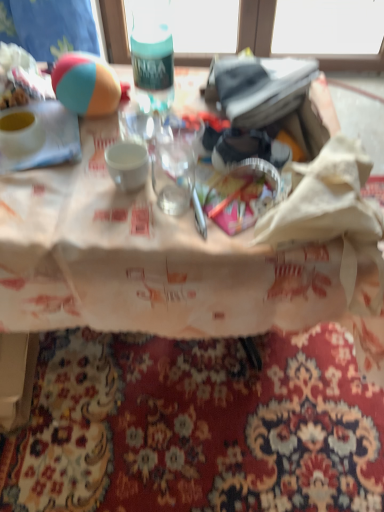
Question: Is matte white bowl at upper left beside teal matte bottle at upper center?

Choices:
 (A) yes
 (B) no

Answer: (B)

Question: Is matte white bowl at upper left oriented towards teal matte bottle at upper center?

Choices:
 (A) no
 (B) yes

Answer: (A)

Question: Can you confirm if matte white bowl at upper left is taller than teal matte bottle at upper center?

Choices:
 (A) yes
 (B) no

Answer: (B)

Question: Is matte white bowl at upper left looking in the opposite direction of teal matte bottle at upper center?

Choices:
 (A) yes
 (B) no

Answer: (B)

Question: Is matte white bowl at upper left at the left side of teal matte bottle at upper center?

Choices:
 (A) no
 (B) yes

Answer: (B)

Question: Does matte white bowl at upper left appear on the right side of teal matte bottle at upper center?

Choices:
 (A) no
 (B) yes

Answer: (A)

Question: From the image's perspective, is teal matte bottle at upper center located beneath tri-color rubber ball at upper left?

Choices:
 (A) no
 (B) yes

Answer: (A)

Question: Is teal matte bottle at upper center at the right side of tri-color rubber ball at upper left?

Choices:
 (A) no
 (B) yes

Answer: (B)

Question: Is teal matte bottle at upper center not close to tri-color rubber ball at upper left?

Choices:
 (A) no
 (B) yes

Answer: (A)

Question: From a real-world perspective, is teal matte bottle at upper center over tri-color rubber ball at upper left?

Choices:
 (A) yes
 (B) no

Answer: (A)

Question: Can you confirm if teal matte bottle at upper center is thinner than tri-color rubber ball at upper left?

Choices:
 (A) yes
 (B) no

Answer: (A)

Question: Considering the relative sizes of teal matte bottle at upper center and tri-color rubber ball at upper left in the image provided, is teal matte bottle at upper center shorter than tri-color rubber ball at upper left?

Choices:
 (A) yes
 (B) no

Answer: (B)

Question: Is matte white bowl at upper left not within translucent plastic cup at center?

Choices:
 (A) no
 (B) yes

Answer: (B)